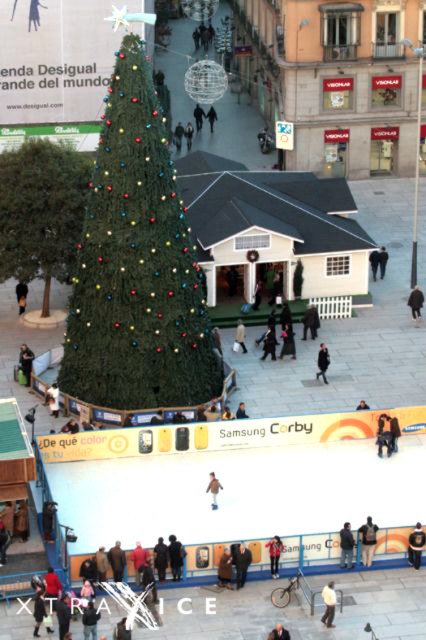
Who is taller, dark blue jacket at center or red leather jacket at lower center?

dark blue jacket at center is taller.

The height and width of the screenshot is (640, 426). In order to click on dark blue jacket at center in this screenshot , I will do `click(416, 545)`.

Does dark blue jeans at lower center lie in front of white cotton jacket at lower center?

No, it is not.

Can you confirm if dark blue jeans at lower center is positioned to the right of white cotton jacket at lower center?

Correct, you'll find dark blue jeans at lower center to the right of white cotton jacket at lower center.

Does point (353, 547) come closer to viewer compared to point (322, 595)?

No, it is not.

Where is `dark blue jeans at lower center`? dark blue jeans at lower center is located at coordinates (347, 545).

In the scene shown: Does dark brown leather jacket at lower center have a greater width compared to brown fuzzy coat at center?

Indeed, dark brown leather jacket at lower center has a greater width compared to brown fuzzy coat at center.

Based on the photo, who is shorter, dark brown leather jacket at lower center or brown fuzzy coat at center?

brown fuzzy coat at center is shorter.

Between point (250, 554) and point (210, 480), which one is positioned behind?

Positioned behind is point (210, 480).

This screenshot has height=640, width=426. Find the location of `dark brown leather jacket at lower center`. dark brown leather jacket at lower center is located at coordinates (241, 563).